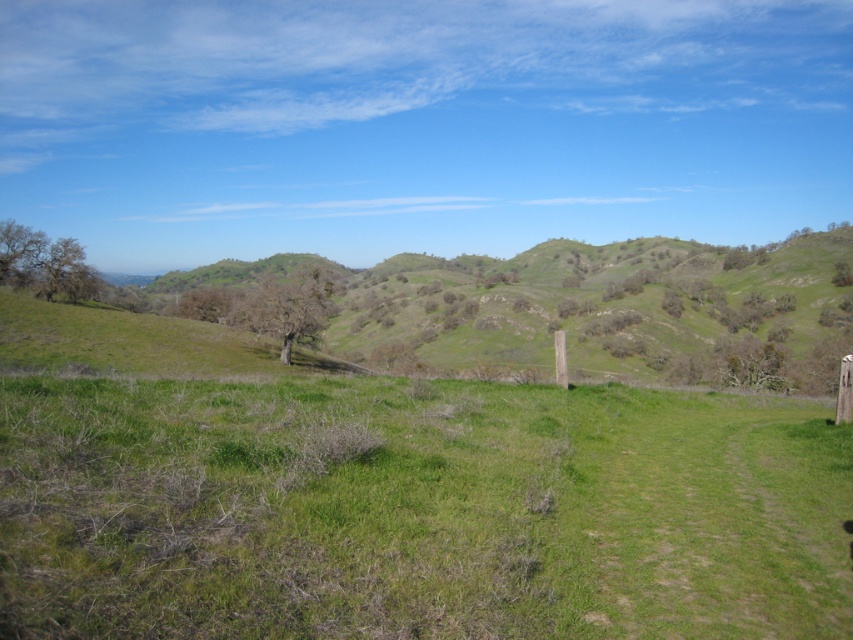
Question: Which point is farther to the camera?

Choices:
 (A) wooden post at right
 (B) green grassy field at center

Answer: (A)

Question: From the image, what is the correct spatial relationship of green grassy field at center in relation to wooden post at right?

Choices:
 (A) above
 (B) below

Answer: (B)

Question: Is green grassy field at center positioned behind wooden post at right?

Choices:
 (A) no
 (B) yes

Answer: (A)

Question: Is green grassy field at center below wooden post at right?

Choices:
 (A) no
 (B) yes

Answer: (B)